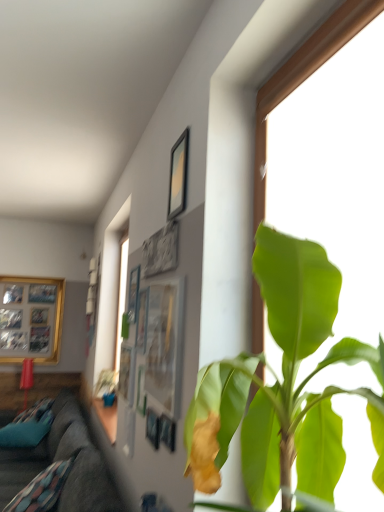
Question: In the image, is matte black picture frame at upper center, marked as the fourth picture frame in a back-to-front arrangement, on the left side or the right side of green leafy plant at center?

Choices:
 (A) left
 (B) right

Answer: (A)

Question: Is matte black picture frame at upper center, marked as the fourth picture frame in a back-to-front arrangement, bigger or smaller than green leafy plant at center?

Choices:
 (A) big
 (B) small

Answer: (B)

Question: Which of these objects is positioned farthest from the dark gray fabric couch at lower left?

Choices:
 (A) matte glass picture frame at center, the fourth picture frame when ordered from left to right
 (B) matte black picture frame at upper center, which is counted as the fifth picture frame, starting from the left
 (C) metallic silver picture frame at upper center, which is counted as the 4th picture frame, starting from the right
 (D) wooden photo frame at left, which appears as the 5th picture frame when viewed from the front
 (E) matte black picture frame at upper center, which ranks as the 3th picture frame in front-to-back order

Answer: (D)

Question: Considering the real-world distances, which object is farthest from the metallic silver picture frame at upper center, which is the 2th picture frame in left-to-right order?

Choices:
 (A) matte glass picture frame at center, positioned as the 1th picture frame in front-to-back order
 (B) dark gray fabric couch at lower left
 (C) matte black picture frame at upper center, which is counted as the 3th picture frame, starting from the left
 (D) wooden photo frame at left, the 1th picture frame viewed from the left
 (E) matte black picture frame at upper center, the first picture frame when ordered from right to left

Answer: (D)